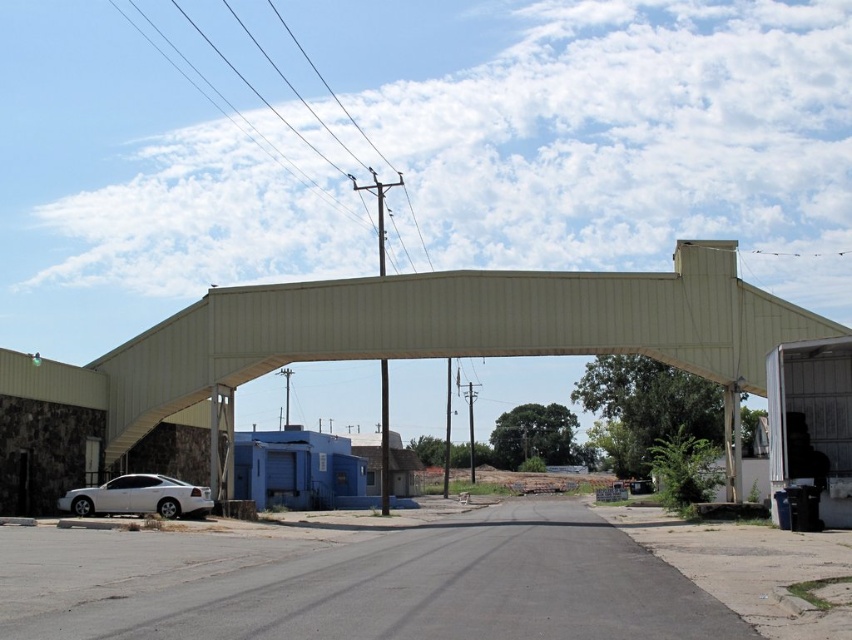
Who is taller, metallic roof at center or white glossy sedan at lower left?

metallic roof at center is taller.

Is metallic roof at center positioned in front of white glossy sedan at lower left?

Yes.

Does point (55, 468) come behind point (105, 512)?

Yes, it is behind point (105, 512).

Where is `metallic roof at center`? This screenshot has width=852, height=640. metallic roof at center is located at coordinates (377, 349).